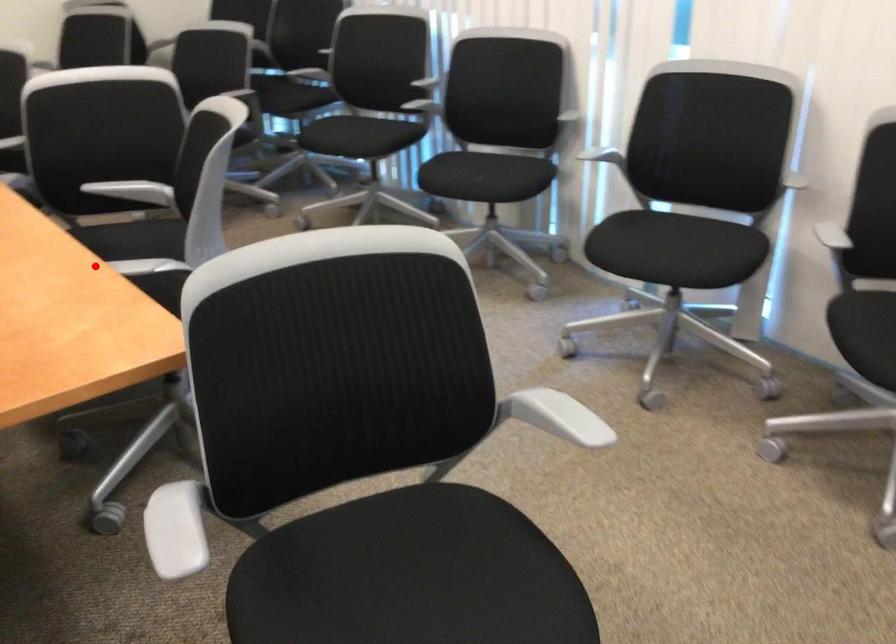
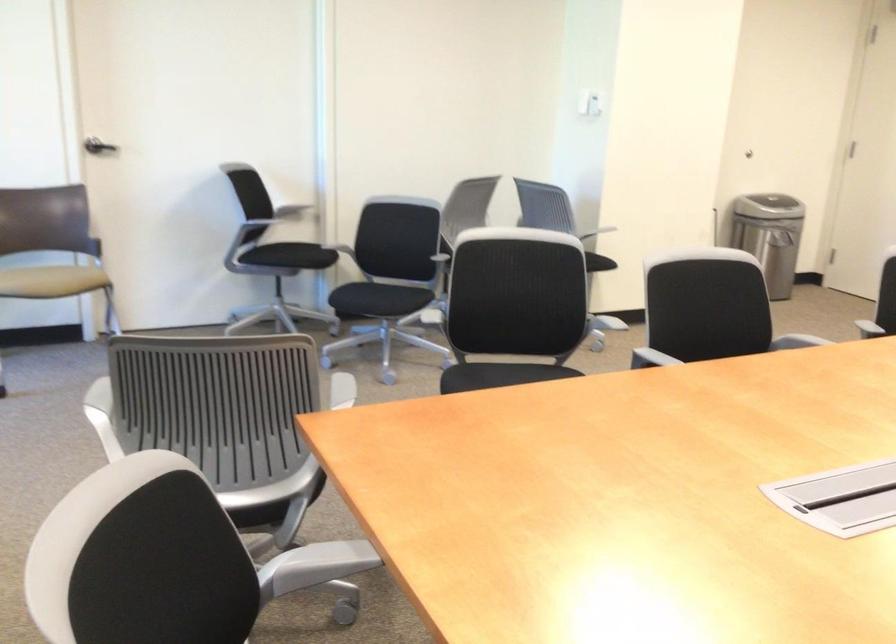
Question: A red point is marked in image1. In image2, is the corresponding 3D point closer to the camera or farther? Reply with the corresponding letter.

Choices:
 (A) The corresponding 3D point is closer.
 (B) The corresponding 3D point is farther.

Answer: (A)